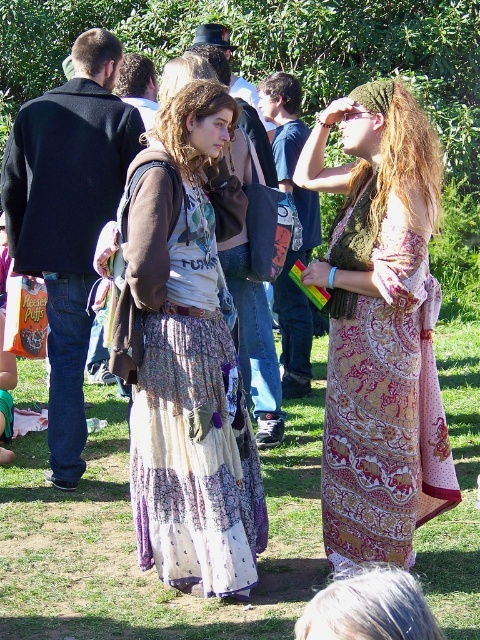
Who is higher up, printed cotton skirt at center or patterned fabric dress at center?

Positioned higher is patterned fabric dress at center.

In the scene shown: Who is positioned more to the right, printed cotton skirt at center or patterned fabric dress at center?

From the viewer's perspective, patterned fabric dress at center appears more on the right side.

Is point (140, 301) farther from camera compared to point (360, 429)?

No, (140, 301) is closer to viewer.

Locate an element on the screen. The height and width of the screenshot is (640, 480). printed cotton skirt at center is located at coordinates (186, 356).

Can you confirm if green grass at lower center is smaller than patterned fabric dress at center?

No, green grass at lower center is not smaller than patterned fabric dress at center.

Between green grass at lower center and patterned fabric dress at center, which one has more height?

With more height is patterned fabric dress at center.

Is point (181, 637) closer to viewer compared to point (358, 209)?

Yes, point (181, 637) is closer to viewer.

Where is `green grass at lower center`? green grass at lower center is located at coordinates (133, 544).

Is patterned fabric dress at center smaller than boho-patterned skirt at center?

No.

Does patterned fabric dress at center have a greater height compared to boho-patterned skirt at center?

Correct, patterned fabric dress at center is much taller as boho-patterned skirt at center.

Find the location of a particular element. This screenshot has width=480, height=640. patterned fabric dress at center is located at coordinates (380, 328).